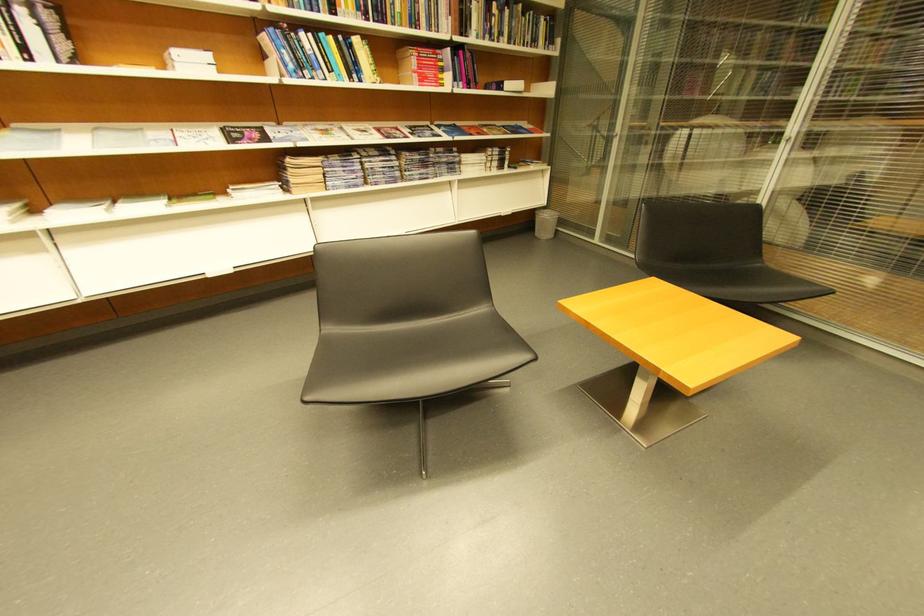
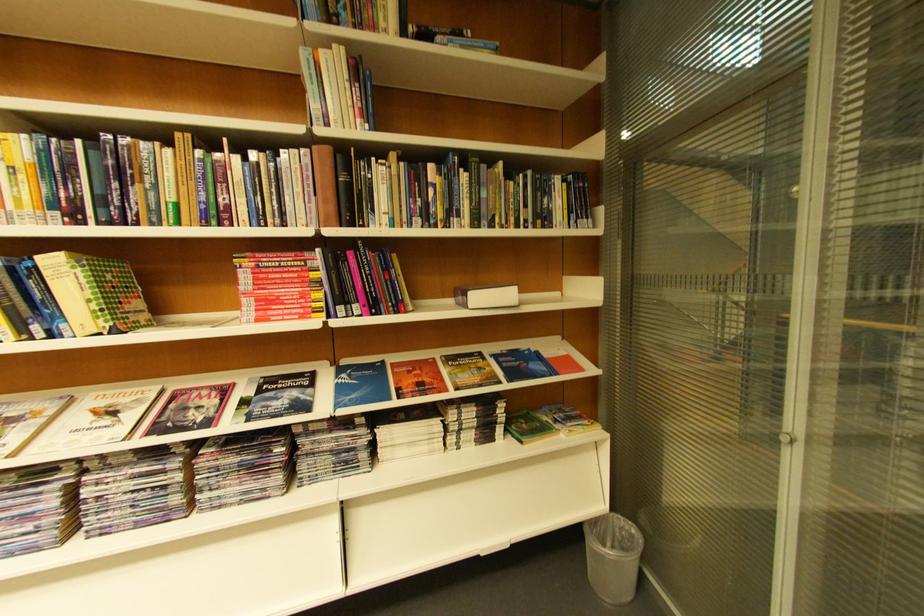
Where in the second image is the point corresponding to point 470,86 from the first image?

(367, 310)